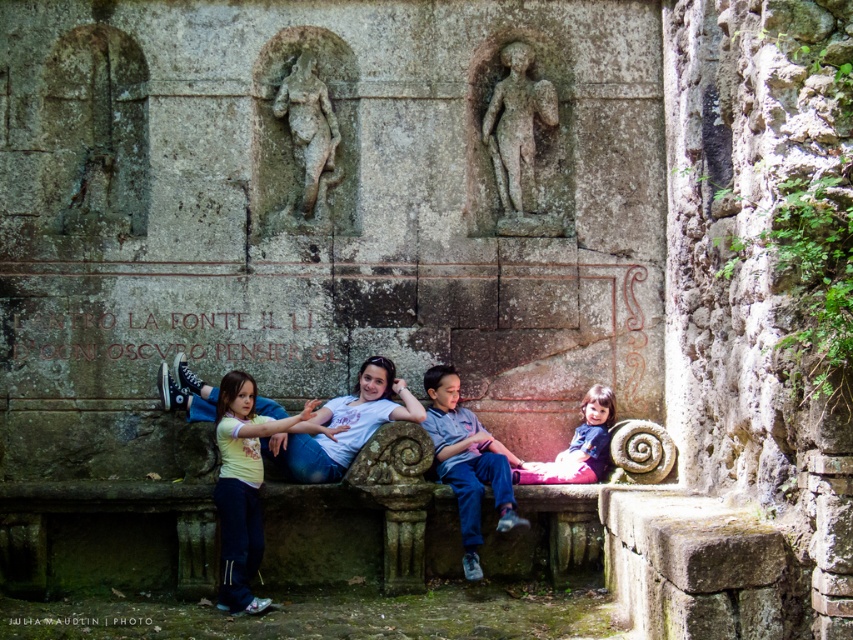
Question: Considering the relative positions of yellow cotton shirt at center and gray stone reclining figure at center in the image provided, where is yellow cotton shirt at center located with respect to gray stone reclining figure at center?

Choices:
 (A) above
 (B) below

Answer: (B)

Question: Where is yellow cotton shirt at center located in relation to gray stone reclining figure at center in the image?

Choices:
 (A) above
 (B) below

Answer: (B)

Question: Which of the following is the farthest from the observer?

Choices:
 (A) (311, 205)
 (B) (514, 456)
 (C) (403, 497)
 (D) (346, 426)

Answer: (A)

Question: Which object is positioned farthest from the gray stone statue at center?

Choices:
 (A) gray stone reclining figure at center
 (B) matte stone bench at center
 (C) matte white t-shirt at center
 (D) matte gray stone bench at center

Answer: (D)

Question: Is matte stone bench at center bigger than matte blue shirt at lower right?

Choices:
 (A) yes
 (B) no

Answer: (A)

Question: Which object is farther from the camera taking this photo?

Choices:
 (A) matte gray stone bench at center
 (B) gray stone reclining figure at center
 (C) gray stone statue at center

Answer: (C)